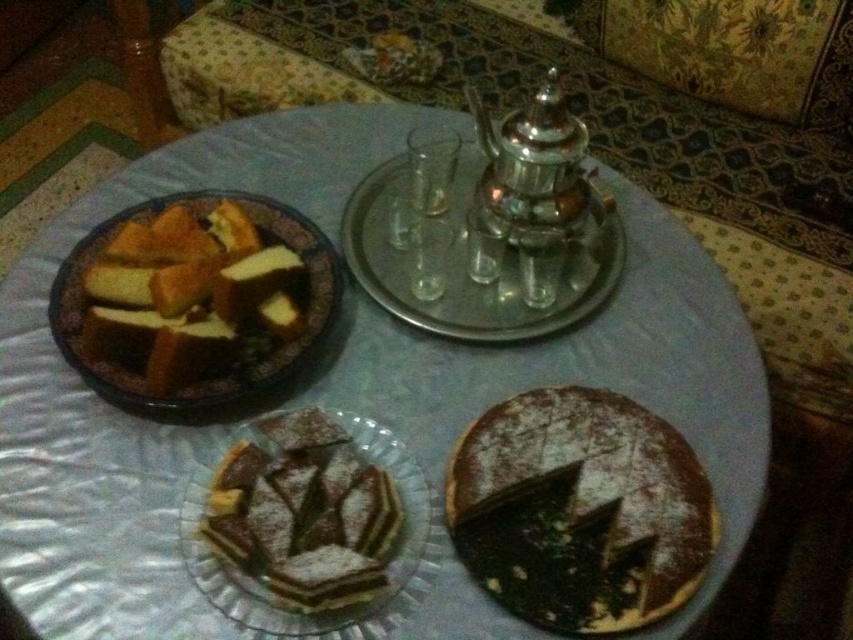
Who is more forward, (700, 577) or (201, 497)?

Point (700, 577)

What are the coordinates of `powdered chocolate cake at lower right` in the screenshot? It's located at (579, 509).

Is the position of brown glazed plate at upper left less distant than that of metallic silver tray at upper center?

Yes, it is in front of metallic silver tray at upper center.

From the picture: Which is below, brown glazed plate at upper left or metallic silver tray at upper center?

brown glazed plate at upper left is below.

Between point (91, 282) and point (463, 296), which one is positioned behind?

Point (463, 296)

Find the location of a particular element. brown glazed plate at upper left is located at coordinates (194, 300).

Based on the photo, is powdered chocolate cake at lower right further to camera compared to brown glazed plate at upper left?

No, it is not.

Based on the photo, who is lower down, powdered chocolate cake at lower right or brown glazed plate at upper left?

powdered chocolate cake at lower right

Is point (601, 515) closer to viewer compared to point (160, 368)?

Yes.

Locate an element on the screen. powdered chocolate cake at lower right is located at coordinates (579, 509).